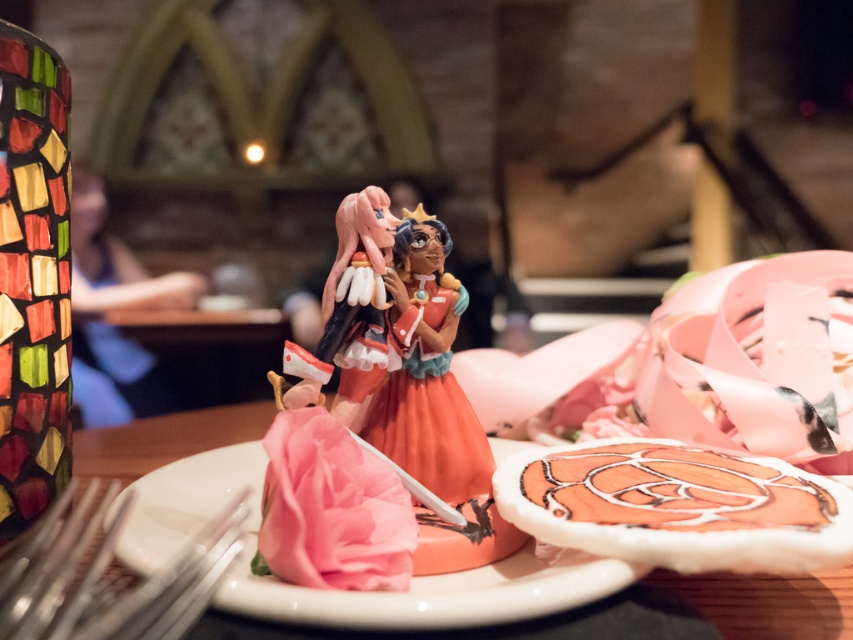
Question: Can you confirm if porcelain figurine at center is smaller than smooth blue shirt at center?

Choices:
 (A) yes
 (B) no

Answer: (A)

Question: Which object appears closest to the camera in this image?

Choices:
 (A) white glossy plate at center
 (B) metallic silver fork at lower left
 (C) smooth blue shirt at center

Answer: (B)

Question: Does white glossy plate at center have a larger size compared to smooth blue shirt at center?

Choices:
 (A) no
 (B) yes

Answer: (A)

Question: Which point appears closest to the camera in this image?

Choices:
 (A) (83, 225)
 (B) (433, 602)

Answer: (B)

Question: Which point is closer to the camera?

Choices:
 (A) (229, 552)
 (B) (119, 298)
 (C) (412, 220)
 (D) (402, 611)

Answer: (A)

Question: Is metallic silver fork at lower left to the right of smooth blue shirt at center from the viewer's perspective?

Choices:
 (A) yes
 (B) no

Answer: (A)